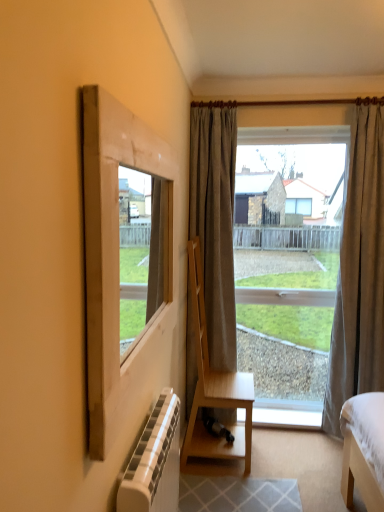
Question: Which direction should I rotate to face gray fabric curtain at center, the 1th curtain positioned from the left, — up or down?

Choices:
 (A) down
 (B) up

Answer: (B)

Question: Is light brown wooden chair at center further to camera compared to matte gray curtain at right, the first curtain positioned from the right?

Choices:
 (A) no
 (B) yes

Answer: (A)

Question: Is light brown wooden chair at center bigger than matte gray curtain at right, positioned as the 2th curtain in left-to-right order?

Choices:
 (A) no
 (B) yes

Answer: (A)

Question: Is light brown wooden chair at center outside of matte gray curtain at right, the first curtain positioned from the right?

Choices:
 (A) no
 (B) yes

Answer: (B)

Question: Considering the relative positions of light brown wooden chair at center and matte gray curtain at right, positioned as the 2th curtain in left-to-right order, in the image provided, is light brown wooden chair at center to the left of matte gray curtain at right, positioned as the 2th curtain in left-to-right order, from the viewer's perspective?

Choices:
 (A) yes
 (B) no

Answer: (A)

Question: Considering the relative positions of light brown wooden chair at center and matte gray curtain at right, the first curtain positioned from the right, in the image provided, is light brown wooden chair at center in front of matte gray curtain at right, the first curtain positioned from the right,?

Choices:
 (A) no
 (B) yes

Answer: (B)

Question: Is light brown wooden chair at center positioned far away from matte gray curtain at right, the first curtain positioned from the right?

Choices:
 (A) yes
 (B) no

Answer: (B)

Question: Is the position of white textured radiator at lower left less distant than that of white painted wood at lower center?

Choices:
 (A) yes
 (B) no

Answer: (A)

Question: From a real-world perspective, is white textured radiator at lower left located beneath white painted wood at lower center?

Choices:
 (A) no
 (B) yes

Answer: (A)

Question: Is white textured radiator at lower left smaller than white painted wood at lower center?

Choices:
 (A) yes
 (B) no

Answer: (B)

Question: Does white textured radiator at lower left turn towards white painted wood at lower center?

Choices:
 (A) yes
 (B) no

Answer: (B)

Question: Considering the relative sizes of white textured radiator at lower left and white painted wood at lower center in the image provided, is white textured radiator at lower left bigger than white painted wood at lower center?

Choices:
 (A) no
 (B) yes

Answer: (B)

Question: From a real-world perspective, does white textured radiator at lower left stand above white painted wood at lower center?

Choices:
 (A) no
 (B) yes

Answer: (B)

Question: Is white textured radiator at lower left touching matte gray curtain at right, positioned as the 2th curtain in left-to-right order?

Choices:
 (A) yes
 (B) no

Answer: (B)